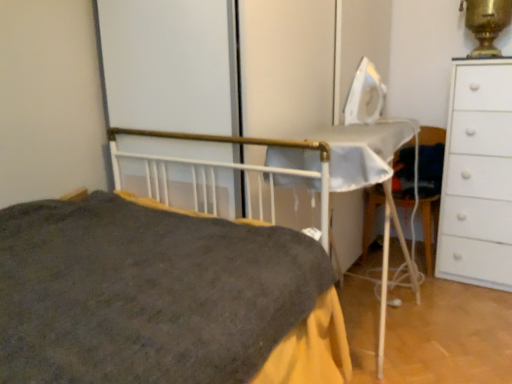
The image size is (512, 384). What do you see at coordinates (429, 226) in the screenshot?
I see `white fabric chair at right` at bounding box center [429, 226].

The height and width of the screenshot is (384, 512). Describe the element at coordinates (487, 24) in the screenshot. I see `gold metallic samovar at upper right` at that location.

At what (x,y) coordinates should I click in order to perform the action: click on white fabric chair at right. Please return your answer as a coordinate pair (x, y). The width and height of the screenshot is (512, 384). Looking at the image, I should click on (429, 226).

Considering their positions, is dark gray fabric bed at center located in front of or behind white matte chest of drawers at right?

dark gray fabric bed at center is in front of white matte chest of drawers at right.

How distant is dark gray fabric bed at center from white matte chest of drawers at right?

The distance of dark gray fabric bed at center from white matte chest of drawers at right is 4.80 feet.

Does dark gray fabric bed at center have a larger size compared to white matte chest of drawers at right?

Yes, dark gray fabric bed at center is bigger than white matte chest of drawers at right.

Which is less distant, (x=272, y=345) or (x=472, y=88)?

Point (x=272, y=345) is closer to the camera than point (x=472, y=88).

Could you tell me if white matte chest of drawers at right is facing white fabric chair at right?

No, white matte chest of drawers at right is not facing towards white fabric chair at right.

Is the surface of white matte chest of drawers at right in direct contact with white fabric chair at right?

No, white matte chest of drawers at right is not next to white fabric chair at right.

Consider the image. Which object is closer to the camera taking this photo, white matte chest of drawers at right or white fabric chair at right?

white matte chest of drawers at right is more forward.

Which is correct: white matte chest of drawers at right is inside white fabric chair at right, or outside of it?

white matte chest of drawers at right cannot be found inside white fabric chair at right.

Is the position of gold metallic samovar at upper right less distant than that of white matte chest of drawers at right?

No, gold metallic samovar at upper right is further to the viewer.

Consider the image. From their relative heights in the image, would you say gold metallic samovar at upper right is taller or shorter than white matte chest of drawers at right?

In the image, gold metallic samovar at upper right appears to be shorter than white matte chest of drawers at right.

From a real-world perspective, between gold metallic samovar at upper right and white matte chest of drawers at right, who is vertically lower?

white matte chest of drawers at right is physically lower.

Is gold metallic samovar at upper right to the right of white matte chest of drawers at right from the viewer's perspective?

No.

In terms of height, does white fabric chair at right look taller or shorter compared to gold metallic samovar at upper right?

Clearly, white fabric chair at right is taller compared to gold metallic samovar at upper right.

Does white fabric chair at right have a smaller size compared to gold metallic samovar at upper right?

No.

From the picture: Can we say white fabric chair at right lies outside gold metallic samovar at upper right?

Absolutely, white fabric chair at right is external to gold metallic samovar at upper right.

How far apart are white fabric chair at right and gold metallic samovar at upper right?

92.96 centimeters.

Between white fabric chair at right and white matte chest of drawers at right, which one has more height?

Standing taller between the two is white matte chest of drawers at right.

Is white fabric chair at right oriented away from white matte chest of drawers at right?

No, white fabric chair at right is not facing the opposite direction of white matte chest of drawers at right.

From the image's perspective, between white fabric chair at right and white matte chest of drawers at right, which one is located above?

white matte chest of drawers at right appears higher in the image.

Which object is closer to the camera taking this photo, gold metallic samovar at upper right or dark gray fabric bed at center?

Positioned in front is dark gray fabric bed at center.

How different are the orientations of gold metallic samovar at upper right and dark gray fabric bed at center in degrees?

84.2 degrees.

In the scene shown: Is gold metallic samovar at upper right shorter than dark gray fabric bed at center?

Yes.

Which point is more distant from viewer, (376, 188) or (174, 337)?

The point (376, 188) is farther.

In the image, is white fabric chair at right positioned in front of or behind dark gray fabric bed at center?

Visually, white fabric chair at right is located behind dark gray fabric bed at center.

From a real-world perspective, is white fabric chair at right located higher than dark gray fabric bed at center?

Incorrect, from a real-world perspective, white fabric chair at right is lower than dark gray fabric bed at center.

From the image's perspective, is white fabric chair at right above dark gray fabric bed at center?

Yes, from the image's perspective, white fabric chair at right is over dark gray fabric bed at center.

Locate an element on the screen. bed below the white matte chest of drawers at right (from a real-world perspective) is located at coordinates (162, 297).

In the image, there is a white fabric chair at right. Identify the location of the chest of drawers above it (from the image's perspective). Image resolution: width=512 pixels, height=384 pixels. (x=478, y=176).

When comparing their distances from dark gray fabric bed at center, does white matte chest of drawers at right or gold metallic samovar at upper right seem further?

gold metallic samovar at upper right lies further to dark gray fabric bed at center than the other object.

Considering their positions, is white matte chest of drawers at right positioned further to white fabric chair at right than dark gray fabric bed at center?

dark gray fabric bed at center is further to white fabric chair at right.

From the image, which object appears to be nearer to white matte chest of drawers at right, white fabric chair at right or dark gray fabric bed at center?

white fabric chair at right is closer to white matte chest of drawers at right.

From the image, which object appears to be nearer to dark gray fabric bed at center, white fabric chair at right or white matte chest of drawers at right?

white matte chest of drawers at right.

Estimate the real-world distances between objects in this image. Which object is closer to white matte chest of drawers at right, dark gray fabric bed at center or gold metallic samovar at upper right?

gold metallic samovar at upper right lies closer to white matte chest of drawers at right than the other object.

From the image, which object appears to be nearer to white fabric chair at right, dark gray fabric bed at center or white matte chest of drawers at right?

white matte chest of drawers at right lies closer to white fabric chair at right than the other object.

Looking at the image, which one is located closer to white fabric chair at right, gold metallic samovar at upper right or white matte chest of drawers at right?

white matte chest of drawers at right is closer to white fabric chair at right.

Looking at the image, which one is located further to gold metallic samovar at upper right, dark gray fabric bed at center or white fabric chair at right?

The object further to gold metallic samovar at upper right is dark gray fabric bed at center.

Image resolution: width=512 pixels, height=384 pixels. In order to click on chest of drawers between gold metallic samovar at upper right and white fabric chair at right in the up-down direction in this screenshot , I will do `click(478, 176)`.

What are the coordinates of `chest of drawers between dark gray fabric bed at center and white fabric chair at right along the z-axis` in the screenshot? It's located at (478, 176).

The image size is (512, 384). What are the coordinates of `table lamp positioned between dark gray fabric bed at center and white fabric chair at right from near to far` in the screenshot? It's located at (487, 24).

Find the location of `table lamp located between dark gray fabric bed at center and white matte chest of drawers at right in the left-right direction`. table lamp located between dark gray fabric bed at center and white matte chest of drawers at right in the left-right direction is located at coordinates (487, 24).